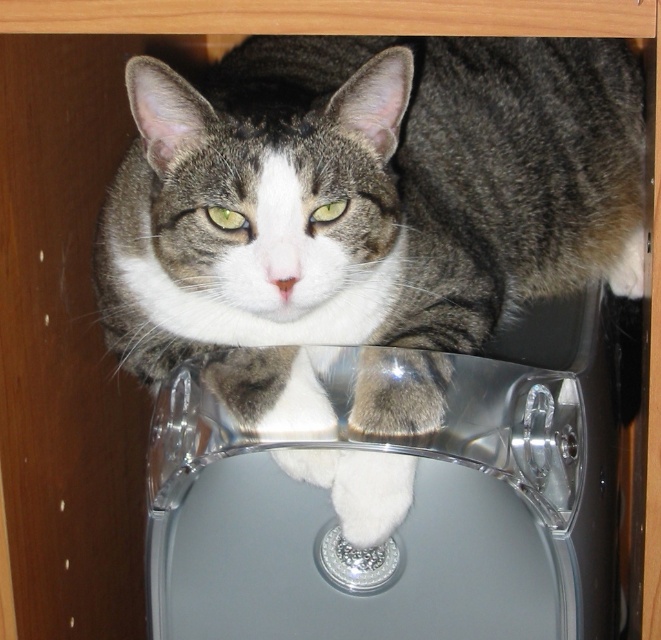
Question: Is tabby fur cat at center to the left of clear plastic sink at center from the viewer's perspective?

Choices:
 (A) yes
 (B) no

Answer: (A)

Question: Is tabby fur cat at center to the right of clear plastic sink at center from the viewer's perspective?

Choices:
 (A) no
 (B) yes

Answer: (A)

Question: Does tabby fur cat at center have a larger size compared to clear plastic sink at center?

Choices:
 (A) no
 (B) yes

Answer: (B)

Question: Which point is farther to the camera?

Choices:
 (A) (171, 448)
 (B) (190, 92)

Answer: (A)

Question: Which of the following is the closest to the observer?

Choices:
 (A) clear plastic sink at center
 (B) tabby fur cat at center

Answer: (B)

Question: Which of the following is the farthest from the observer?

Choices:
 (A) tabby fur cat at center
 (B) clear plastic sink at center

Answer: (B)